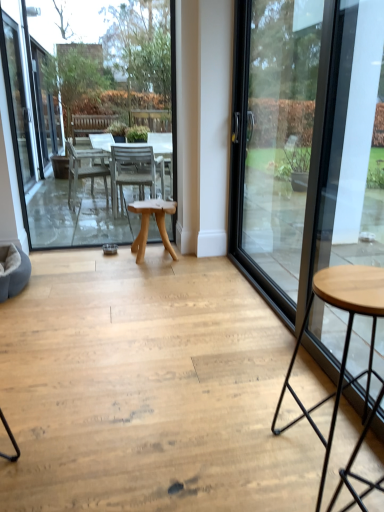
You are a GUI agent. You are given a task and a screenshot of the screen. Output one action in this format:
    pyautogui.click(x=<x>, y=<y>)
    Task: Click on the wooden table at center
    This screenshot has width=384, height=512.
    Given the screenshot: What is the action you would take?
    pyautogui.click(x=88, y=112)

The width and height of the screenshot is (384, 512). I want to click on metallic black stool at lower right, so click(x=347, y=352).

You are a GUI agent. You are given a task and a screenshot of the screen. Output one action in this format:
    pyautogui.click(x=<x>, y=<y>)
    Task: Click on the transparent glass door at right
    This screenshot has width=384, height=512.
    Given the screenshot: What is the action you would take?
    pyautogui.click(x=306, y=143)

This screenshot has height=512, width=384. Identify the location of wooden table at center. (88, 112).

Who is shorter, wooden table at center or metallic black stool at lower right?

metallic black stool at lower right is shorter.

Is wooden table at center thinner than metallic black stool at lower right?

Indeed, wooden table at center has a lesser width compared to metallic black stool at lower right.

Are wooden table at center and metallic black stool at lower right far apart?

Yes, wooden table at center is far from metallic black stool at lower right.

Which is correct: wooden table at center is inside metallic black stool at lower right, or outside of it?

wooden table at center lies outside metallic black stool at lower right.

Looking at their sizes, would you say transparent glass door at right is wider or thinner than wooden table at center?

Clearly, transparent glass door at right has more width compared to wooden table at center.

Is transparent glass door at right next to wooden table at center and touching it?

transparent glass door at right and wooden table at center are not in contact.

Who is smaller, transparent glass door at right or wooden table at center?

wooden table at center is smaller.

Is transparent glass door at right facing towards wooden table at center?

No, transparent glass door at right is not turned towards wooden table at center.

From a real-world perspective, is natural wood table at center over wooden table at center?

Actually, natural wood table at center is physically below wooden table at center in the real world.

Can you see natural wood table at center touching wooden table at center?

No, natural wood table at center is not making contact with wooden table at center.

What's the angular difference between natural wood table at center and wooden table at center's facing directions?

The angle between the facing direction of natural wood table at center and the facing direction of wooden table at center is 90.4 degrees.

Locate an element on the screen. The height and width of the screenshot is (512, 384). table that is behind the transparent glass door at right is located at coordinates (148, 224).

Is natural wood table at center far away from transparent glass door at right?

Yes, natural wood table at center and transparent glass door at right are located far from each other.

Between natural wood table at center and transparent glass door at right, which one has larger size?

With larger size is transparent glass door at right.

Is transparent glass door at right completely or partially inside natural wood table at center?

No, transparent glass door at right is not inside natural wood table at center.

Who is taller, wooden table at center or natural wood table at center?

wooden table at center is taller.

From a real-world perspective, who is located lower, wooden table at center or natural wood table at center?

→ natural wood table at center.

From the image's perspective, is wooden table at center located above natural wood table at center?

Yes.

Is point (357, 287) farther from camera compared to point (83, 168)?

No, (357, 287) is in front of (83, 168).

Locate an element on the screen. coffee table in front of the wooden table at center is located at coordinates (347, 352).

Based on the photo, is metallic black stool at lower right positioned with its back to wooden table at center?

No.

Considering the sizes of objects metallic black stool at lower right and wooden table at center in the image provided, who is smaller, metallic black stool at lower right or wooden table at center?

With smaller size is metallic black stool at lower right.

From the image's perspective, is transparent glass door at right located above or below natural wood table at center?

transparent glass door at right is situated higher than natural wood table at center in the image.

Would you say transparent glass door at right is outside natural wood table at center?

Yes, transparent glass door at right is located beyond the bounds of natural wood table at center.

Which of these two, transparent glass door at right or natural wood table at center, is bigger?

transparent glass door at right.

Which object is thinner, transparent glass door at right or natural wood table at center?

transparent glass door at right is thinner.

At what (x,y) coordinates should I click in order to perform the action: click on window screen above the metallic black stool at lower right (from a real-world perspective). Please return your answer as a coordinate pair (x, y). The image size is (384, 512). Looking at the image, I should click on (88, 112).

At what (x,y) coordinates should I click in order to perform the action: click on door in front of the wooden table at center. Please return your answer as a coordinate pair (x, y). Image resolution: width=384 pixels, height=512 pixels. Looking at the image, I should click on (306, 143).

Considering their positions, is natural wood table at center positioned further to wooden table at center than transparent glass door at right?

Among the two, transparent glass door at right is located further to wooden table at center.

Which object lies further to the anchor point natural wood table at center, transparent glass door at right or metallic black stool at lower right?

metallic black stool at lower right.

From the image, which object appears to be farther from transparent glass door at right, natural wood table at center or metallic black stool at lower right?

Based on the image, metallic black stool at lower right appears to be further to transparent glass door at right.

Estimate the real-world distances between objects in this image. Which object is closer to metallic black stool at lower right, natural wood table at center or transparent glass door at right?

transparent glass door at right is positioned closer to the anchor metallic black stool at lower right.

Which object lies nearer to the anchor point transparent glass door at right, metallic black stool at lower right or natural wood table at center?

natural wood table at center is positioned closer to the anchor transparent glass door at right.

From the image, which object appears to be farther from natural wood table at center, wooden table at center or transparent glass door at right?

Among the two, wooden table at center is located further to natural wood table at center.

Looking at the image, which one is located closer to transparent glass door at right, wooden table at center or natural wood table at center?

natural wood table at center is closer to transparent glass door at right.

Looking at the image, which one is located closer to wooden table at center, metallic black stool at lower right or natural wood table at center?

The object closer to wooden table at center is natural wood table at center.

Locate an element on the screen. The height and width of the screenshot is (512, 384). door positioned between metallic black stool at lower right and natural wood table at center from near to far is located at coordinates (306, 143).

Identify the location of window screen between metallic black stool at lower right and natural wood table at center in the front-back direction. The height and width of the screenshot is (512, 384). (88, 112).

The image size is (384, 512). What are the coordinates of `door positioned between metallic black stool at lower right and wooden table at center from near to far` in the screenshot? It's located at (306, 143).

Where is `window screen between transparent glass door at right and natural wood table at center from front to back`? Image resolution: width=384 pixels, height=512 pixels. window screen between transparent glass door at right and natural wood table at center from front to back is located at coordinates (88, 112).